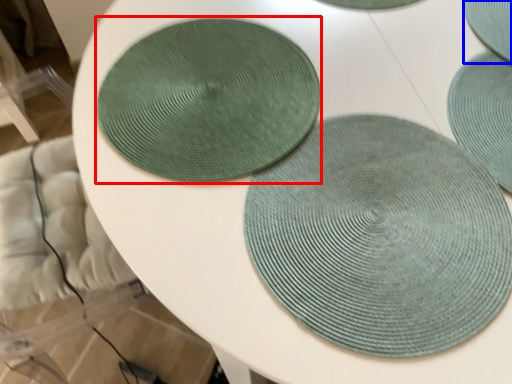
Question: Which object appears closest to the camera in this image, coaster (highlighted by a red box) or coaster (highlighted by a blue box)?

Choices:
 (A) coaster
 (B) coaster

Answer: (A)